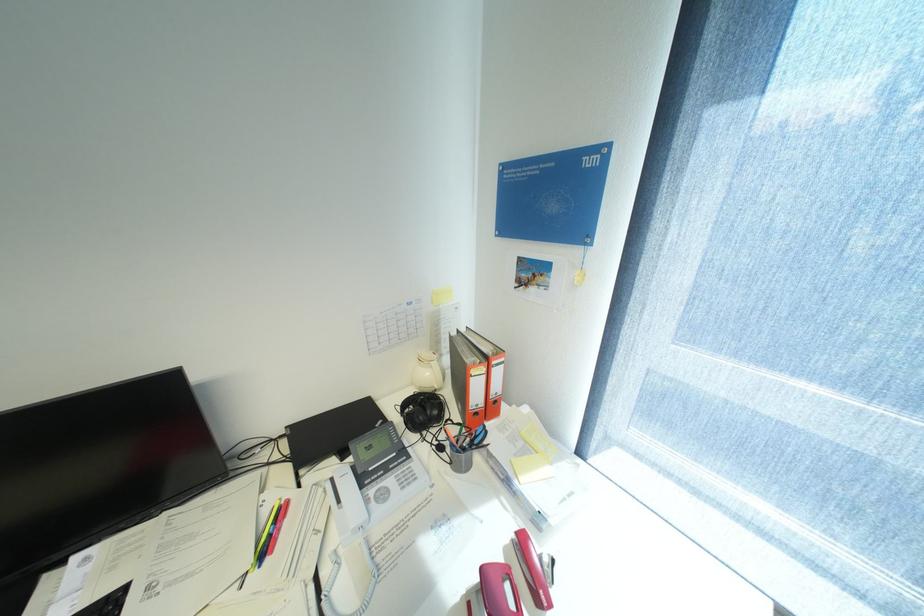
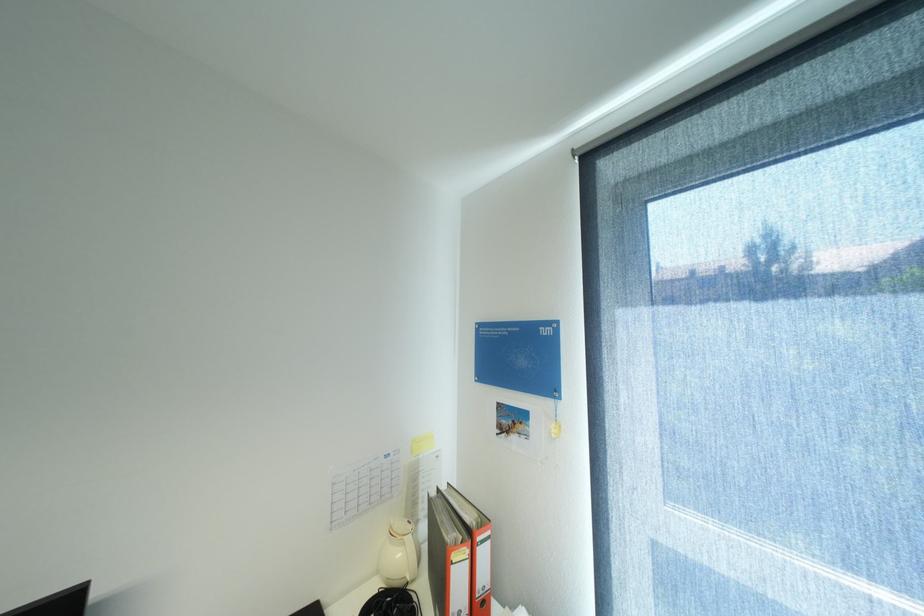
Question: How did the camera likely rotate?

Choices:
 (A) Left
 (B) Right
 (C) Up
 (D) Down

Answer: (C)